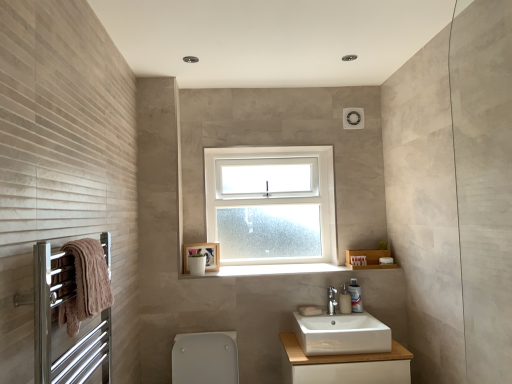
Question: Does white ceramic sink at center come in front of white glossy soap dispenser at lower right?

Choices:
 (A) yes
 (B) no

Answer: (A)

Question: From a real-world perspective, is white ceramic sink at center physically below white glossy soap dispenser at lower right?

Choices:
 (A) yes
 (B) no

Answer: (A)

Question: Does white ceramic sink at center have a greater width compared to white glossy soap dispenser at lower right?

Choices:
 (A) no
 (B) yes

Answer: (B)

Question: Does white ceramic sink at center turn towards white glossy soap dispenser at lower right?

Choices:
 (A) yes
 (B) no

Answer: (B)

Question: Does white ceramic sink at center have a smaller size compared to white glossy soap dispenser at lower right?

Choices:
 (A) yes
 (B) no

Answer: (B)

Question: Is point click(x=180, y=334) closer or farther from the camera than point click(x=333, y=294)?

Choices:
 (A) closer
 (B) farther

Answer: (A)

Question: Which is correct: white glossy toilet bowl at lower center is inside white ceramic tap at center, or outside of it?

Choices:
 (A) inside
 (B) outside

Answer: (B)

Question: From a real-world perspective, is white glossy toilet bowl at lower center above or below white ceramic tap at center?

Choices:
 (A) above
 (B) below

Answer: (B)

Question: Is white glossy toilet bowl at lower center in front of or behind white ceramic tap at center in the image?

Choices:
 (A) behind
 (B) front

Answer: (B)

Question: Is white glossy soap dispenser at lower right taller or shorter than white smooth window sill at center?

Choices:
 (A) tall
 (B) short

Answer: (A)

Question: Relative to white smooth window sill at center, is white glossy soap dispenser at lower right in front or behind?

Choices:
 (A) behind
 (B) front

Answer: (B)

Question: Is point (340, 291) closer or farther from the camera than point (324, 268)?

Choices:
 (A) closer
 (B) farther

Answer: (A)

Question: Is white glossy soap dispenser at lower right inside the boundaries of white smooth window sill at center, or outside?

Choices:
 (A) outside
 (B) inside

Answer: (A)

Question: Is point (96, 284) closer or farther from the camera than point (110, 340)?

Choices:
 (A) farther
 (B) closer

Answer: (B)

Question: Do you think brown towel at left is within silver metallic towel rack at left, or outside of it?

Choices:
 (A) outside
 (B) inside

Answer: (B)